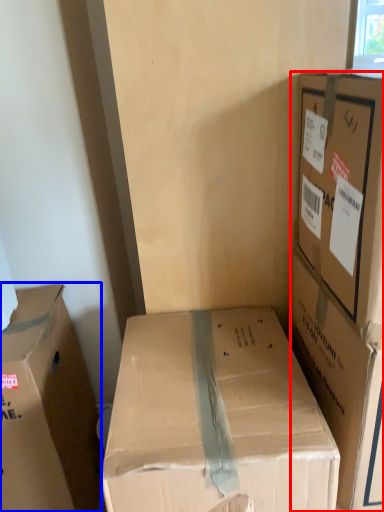
Question: Which of the following is the farthest to the observer, box (highlighted by a red box) or box (highlighted by a blue box)?

Choices:
 (A) box
 (B) box

Answer: (B)